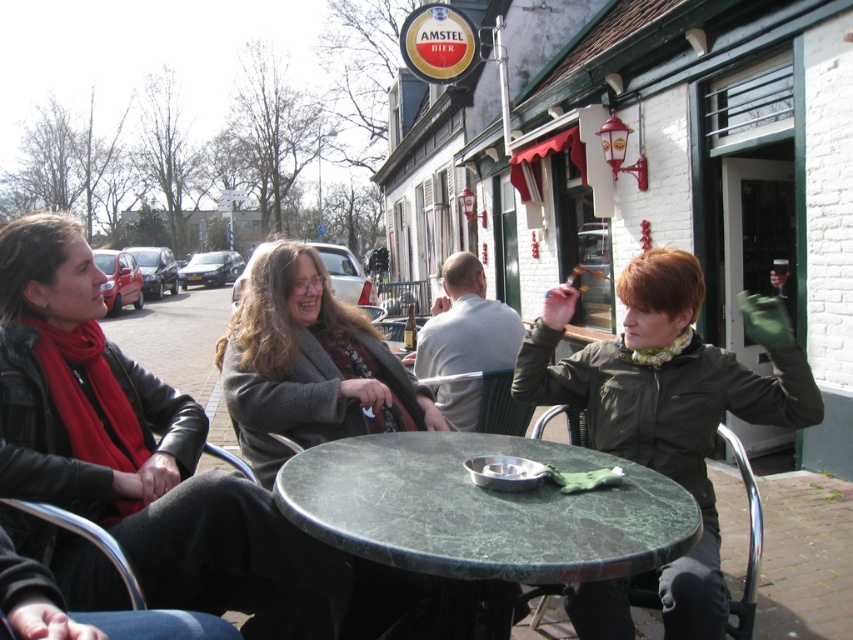
You are a customer at the outdoor Amstel Bier cafe and want to place your phone between the leather jacket at left and the gray woolen sweater at center. Which item should you place it closer to to ensure the phone stays upright?

The leather jacket at left has a greater height compared to the gray woolen sweater at center, so placing the phone closer to the leather jacket at left would provide a more stable and upright position.

You are a waiter at the Amstel Bier cafe. You need to place a 12 inch diameter dessert plate on the green marble table at center. Can you put it there without overlapping the gray woolen sweater at center?

The green marble table at center and gray woolen sweater at center are 31.67 inches apart. Since the dessert plate is only 12 inches in diameter, there is enough space between them to place the plate without overlapping.